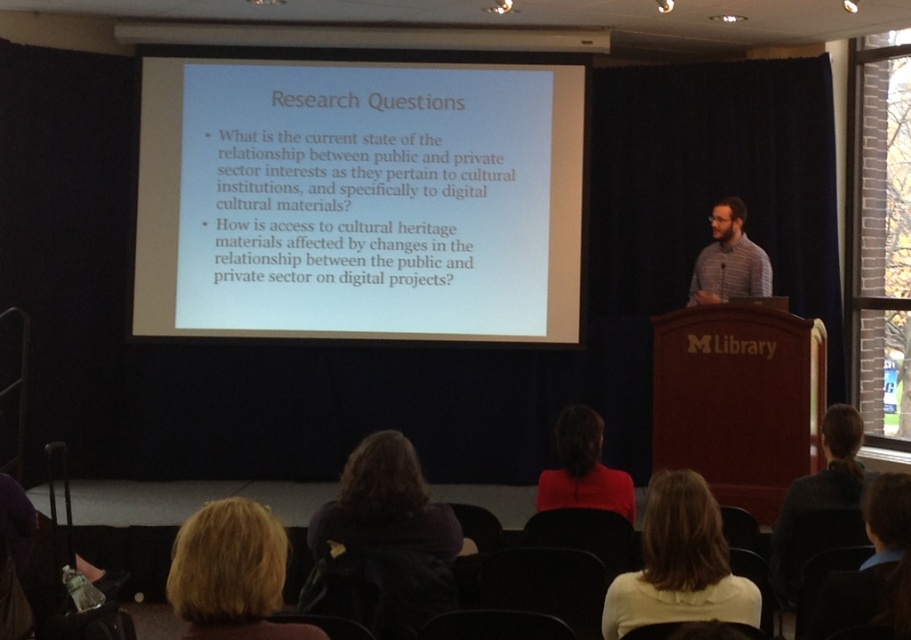
You are a photographer standing at the back of the room. You want to take a photo of the dark purple hoodie at lower center and the striped cotton shirt at upper right in the same frame. The camera has a focal length of 50mm. Can both objects be captured in the same frame without moving the camera?

The dark purple hoodie at lower center is 3.43 meters away from the striped cotton shirt at upper right. At a focal length of 50mm, the camera can capture objects within a certain distance apart in the same frame. Since 3.43 meters is within the typical field of view for a 50mm lens at this distance, both the dark purple hoodie at lower center and the striped cotton shirt at upper right can likely be included in the same frame without moving the camera.

You are an attendee at this presentation and you want to see both the dark purple hoodie at lower center and the striped cotton shirt at upper right. Which one is located to the left of the other?

The dark purple hoodie at lower center is positioned on the left side of striped cotton shirt at upper right.

You are sitting at the back of the lecture hall and want to read the text on the white matte projection screen at upper center. There is a person wearing a red matte shirt at center blocking your view. Can you see the projection screen clearly?

The white matte projection screen at upper center is further to the viewer than the red matte shirt at center. This means the projection screen is closer to you, so you can see it clearly over the person in the red matte shirt at center.